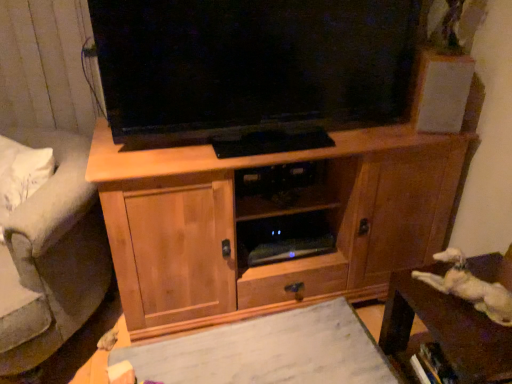
Question: Does gray fabric armchair at left have a greater width compared to white matte speaker at upper right?

Choices:
 (A) no
 (B) yes

Answer: (B)

Question: Can you confirm if gray fabric armchair at left is smaller than white matte speaker at upper right?

Choices:
 (A) yes
 (B) no

Answer: (B)

Question: Is gray fabric armchair at left positioned behind white matte speaker at upper right?

Choices:
 (A) yes
 (B) no

Answer: (B)

Question: Is gray fabric armchair at left looking in the opposite direction of white matte speaker at upper right?

Choices:
 (A) yes
 (B) no

Answer: (B)

Question: Is gray fabric armchair at left at the right side of white matte speaker at upper right?

Choices:
 (A) yes
 (B) no

Answer: (B)

Question: In terms of width, does white fluffy cat at lower right look wider or thinner when compared to gray fabric armchair at left?

Choices:
 (A) wide
 (B) thin

Answer: (B)

Question: Does point [459, 259] appear closer or farther from the camera than point [20, 205]?

Choices:
 (A) closer
 (B) farther

Answer: (B)

Question: From a real-world perspective, is white fluffy cat at lower right positioned above or below gray fabric armchair at left?

Choices:
 (A) above
 (B) below

Answer: (A)

Question: In the image, is white fluffy cat at lower right on the left side or the right side of gray fabric armchair at left?

Choices:
 (A) right
 (B) left

Answer: (A)

Question: Is white matte paper at center spatially inside brown wooden table at lower right, or outside of it?

Choices:
 (A) inside
 (B) outside

Answer: (B)

Question: From the image's perspective, is white matte paper at center above or below brown wooden table at lower right?

Choices:
 (A) below
 (B) above

Answer: (A)

Question: Is point (330, 307) positioned closer to the camera than point (409, 289)?

Choices:
 (A) closer
 (B) farther

Answer: (B)

Question: Is white matte paper at center taller or shorter than brown wooden table at lower right?

Choices:
 (A) tall
 (B) short

Answer: (B)

Question: In terms of width, does white fluffy cat at lower right look wider or thinner when compared to white matte paper at center?

Choices:
 (A) wide
 (B) thin

Answer: (B)

Question: Based on their positions, is white fluffy cat at lower right located to the left or right of white matte paper at center?

Choices:
 (A) right
 (B) left

Answer: (A)